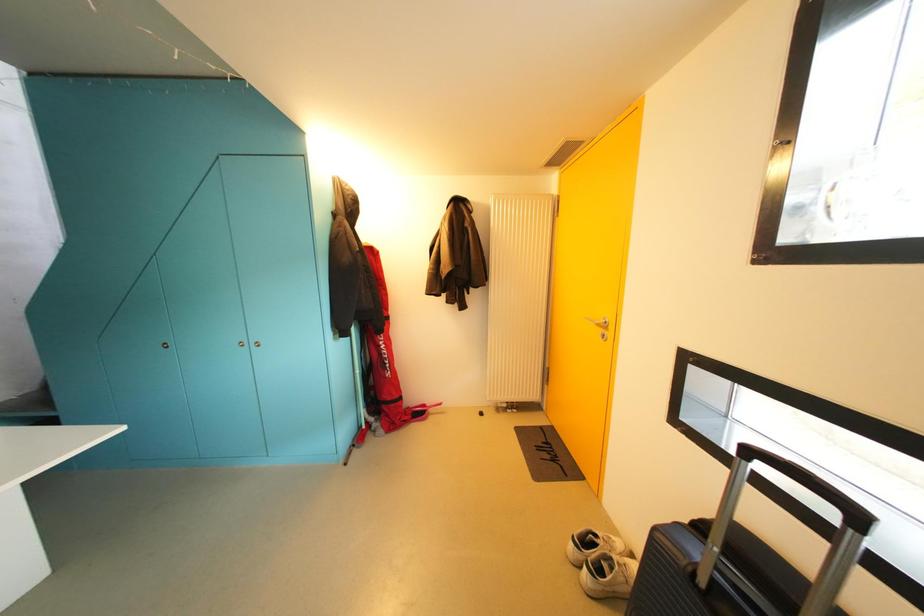
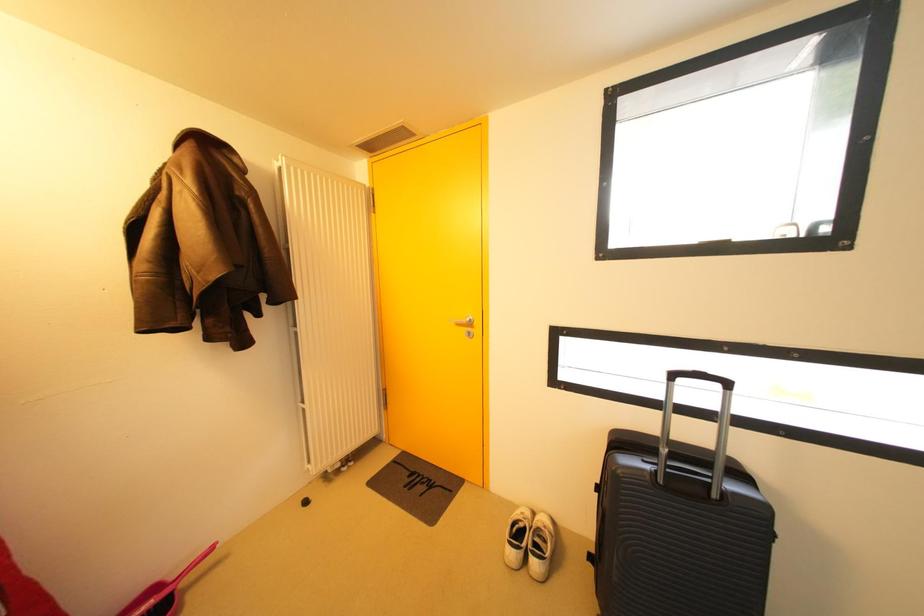
Question: The first image is from the beginning of the video and the second image is from the end. How did the camera likely rotate when shooting the video?

Choices:
 (A) Left
 (B) Right
 (C) Up
 (D) Down

Answer: (B)